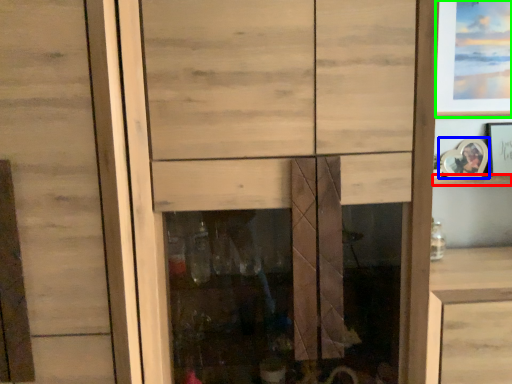
Question: Which object is the farthest from shelf (highlighted by a red box)? Choose among these: picture frame (highlighted by a blue box) or picture frame (highlighted by a green box).

Choices:
 (A) picture frame
 (B) picture frame

Answer: (B)